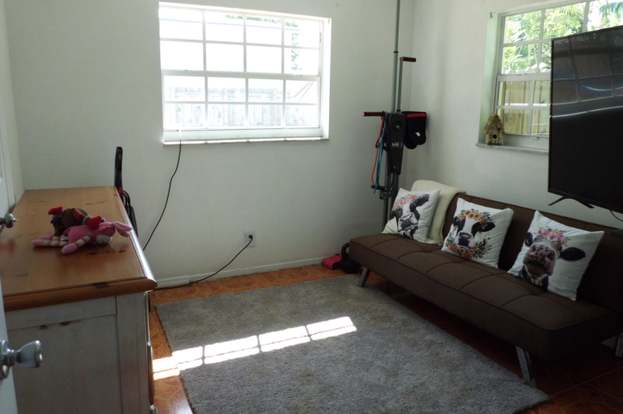
You are a GUI agent. You are given a task and a screenshot of the screen. Output one action in this format:
    pyautogui.click(x=<x>, y=<y>)
    Task: Click on the power cords
    This screenshot has height=414, width=623.
    Given the screenshot: What is the action you would take?
    pyautogui.click(x=179, y=147), pyautogui.click(x=230, y=258)